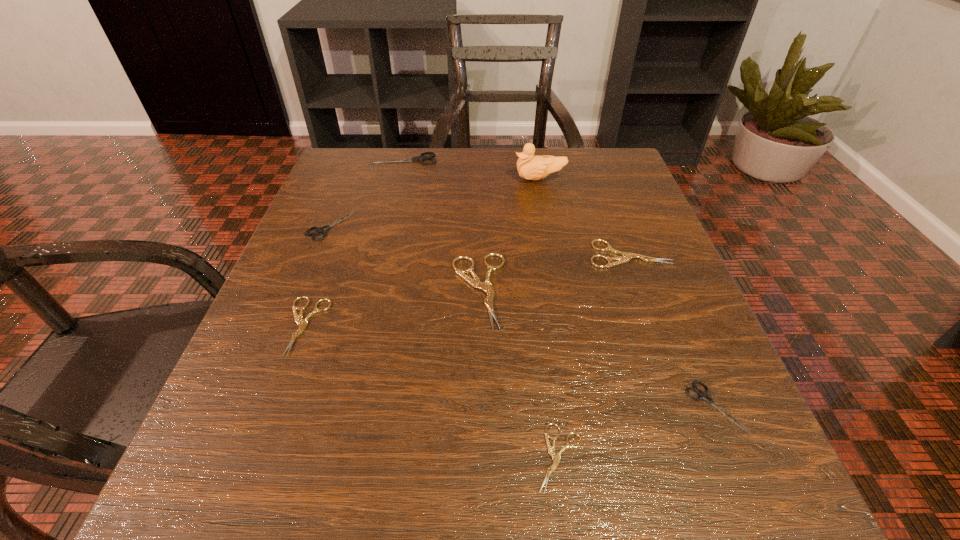
Find the location of a particular element. The width and height of the screenshot is (960, 540). vacant position located 0.150m on the back of the leftmost beige shears is located at coordinates (336, 241).

Where is `free space located 0.250m on the back of the nearest black shears`? free space located 0.250m on the back of the nearest black shears is located at coordinates (655, 264).

This screenshot has width=960, height=540. What are the coordinates of `vacant space located 0.300m on the back of the nearest beige shears` in the screenshot? It's located at (536, 269).

Identify the location of duckling that is at the far edge. (530, 167).

I want to click on shears located in the far edge section of the desktop, so click(x=420, y=158).

Identify the location of object that is at the near edge. (556, 457).

You are a GUI agent. You are given a task and a screenshot of the screen. Output one action in this format:
    pyautogui.click(x=<x>, y=<y>)
    Task: Click on the duckling located at the right edge
    This screenshot has height=540, width=960.
    Given the screenshot: What is the action you would take?
    pyautogui.click(x=530, y=167)

You are a GUI agent. You are given a task and a screenshot of the screen. Output one action in this format:
    pyautogui.click(x=<x>, y=<y>)
    Task: Click on the object that is at the far left corner
    Image resolution: width=960 pixels, height=540 pixels.
    Given the screenshot: What is the action you would take?
    [420, 158]

In order to click on object situated at the far right corner in this screenshot , I will do `click(530, 167)`.

This screenshot has width=960, height=540. In the image, there is a desktop. Identify the location of vacant space at the far edge. tap(444, 187).